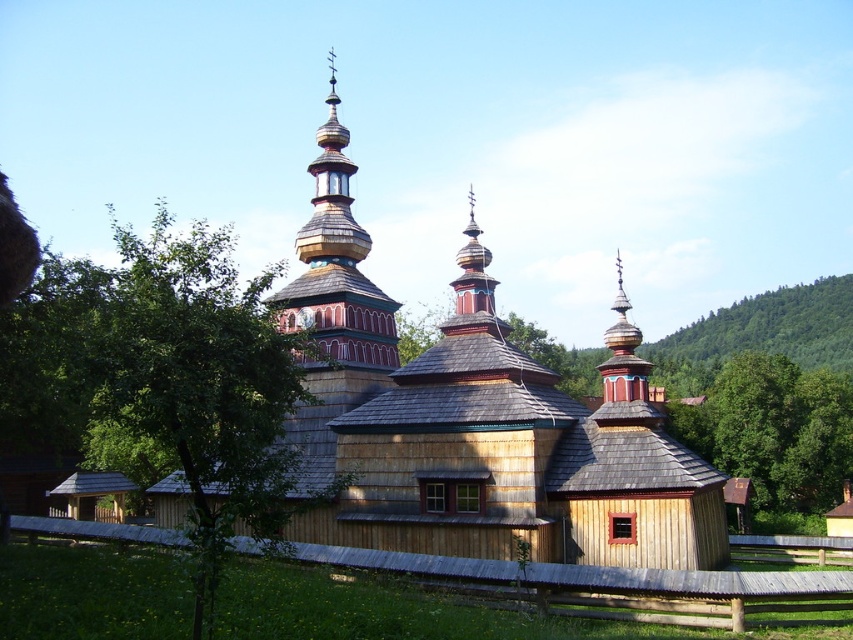
Does wooden church at center appear on the left side of painted wood tower at upper center?

No, wooden church at center is not to the left of painted wood tower at upper center.

Who is more forward, (643, 445) or (355, 301)?

Point (643, 445)

What do you see at coordinates (474, 420) in the screenshot? I see `wooden church at center` at bounding box center [474, 420].

This screenshot has width=853, height=640. Find the location of `wooden church at center`. wooden church at center is located at coordinates (474, 420).

Is green leafy tree at right smaller than painted wood tower at upper center?

Correct, green leafy tree at right occupies less space than painted wood tower at upper center.

Identify the location of green leafy tree at right. (775, 429).

Is wooden church at center closer to camera compared to green leafy tree at right?

Yes, it is.

Is wooden church at center shorter than green leafy tree at right?

In fact, wooden church at center may be taller than green leafy tree at right.

What are the coordinates of `wooden church at center` in the screenshot? It's located at (474, 420).